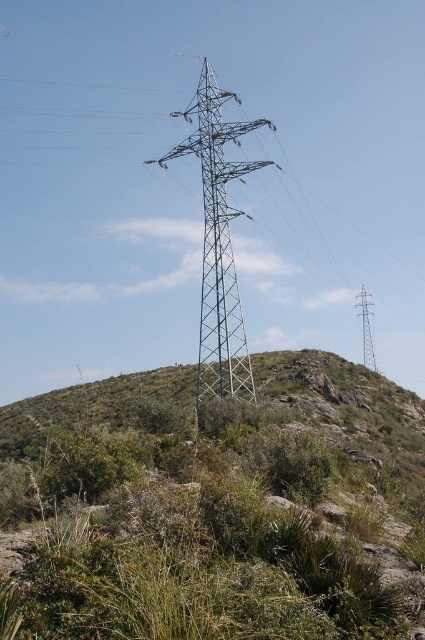
Is point (311, 634) farther from viewer compared to point (368, 292)?

No, it is not.

Is green grassy shrubs at center positioned behind metallic silver tower at center?

No, it is in front of metallic silver tower at center.

Describe the element at coordinates (204, 545) in the screenshot. I see `green grassy shrubs at center` at that location.

This screenshot has width=425, height=640. I want to click on green grassy shrubs at center, so click(204, 545).

Does metallic grid tower at center come in front of metallic silver tower at center?

Yes.

Which is more to the left, metallic grid tower at center or metallic silver tower at center?

metallic grid tower at center

At what (x,y) coordinates should I click in order to perform the action: click on metallic grid tower at center. Please return your answer as a coordinate pair (x, y). Looking at the image, I should click on (218, 241).

This screenshot has width=425, height=640. What are the coordinates of `metallic grid tower at center` in the screenshot? It's located at (218, 241).

Looking at this image, between green grassy shrubs at center and metallic grid tower at center, which one is positioned higher?

metallic grid tower at center is higher up.

Can you confirm if green grassy shrubs at center is positioned to the right of metallic grid tower at center?

Correct, you'll find green grassy shrubs at center to the right of metallic grid tower at center.

Which is behind, point (260, 588) or point (209, 282)?

Positioned behind is point (209, 282).

The image size is (425, 640). I want to click on green grassy shrubs at center, so click(204, 545).